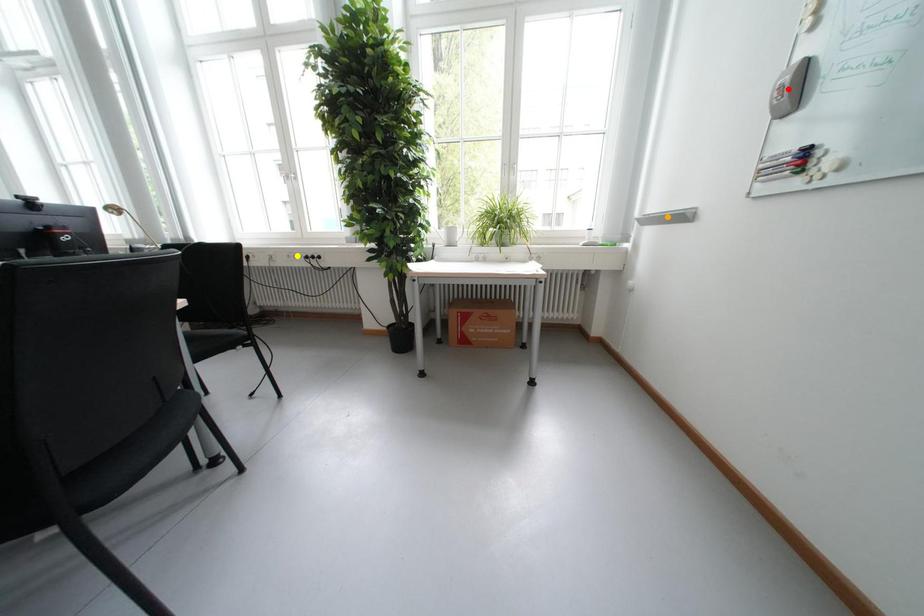
Order these from nearest to farthest:
yellow point
orange point
red point

red point, orange point, yellow point